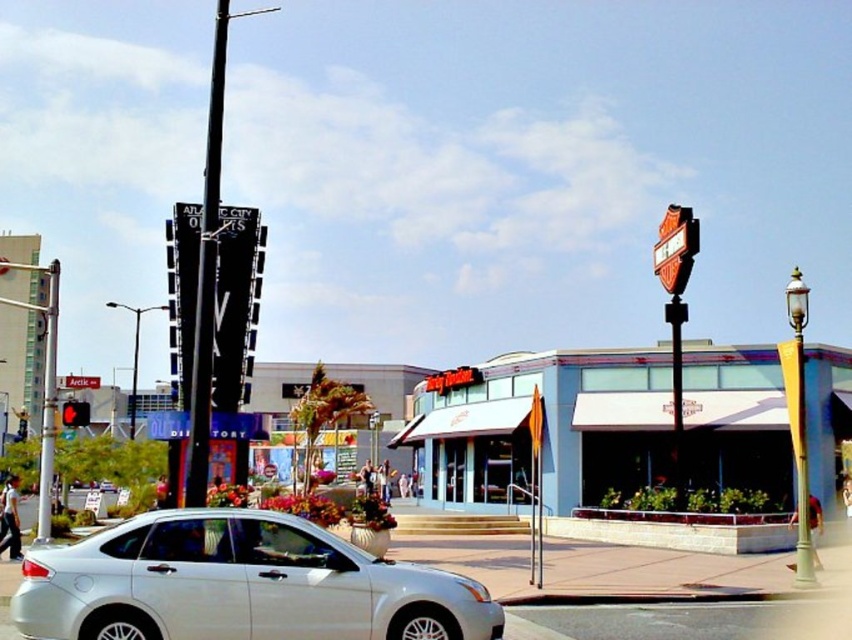
Who is shorter, black metal pole at upper left or red glass traffic light at left?

Standing shorter between the two is red glass traffic light at left.

Which is below, black metal pole at upper left or red glass traffic light at left?

red glass traffic light at left is lower down.

This screenshot has height=640, width=852. What do you see at coordinates (206, 275) in the screenshot? I see `black metal pole at upper left` at bounding box center [206, 275].

Where is `black metal pole at upper left`? The height and width of the screenshot is (640, 852). black metal pole at upper left is located at coordinates (206, 275).

Does white glossy sedan at lower left appear over metallic traffic light at left?

Correct, white glossy sedan at lower left is located above metallic traffic light at left.

Who is more forward, (26,576) or (43,484)?

Point (26,576) is more forward.

Image resolution: width=852 pixels, height=640 pixels. Describe the element at coordinates (239, 584) in the screenshot. I see `white glossy sedan at lower left` at that location.

You are a GUI agent. You are given a task and a screenshot of the screen. Output one action in this format:
    pyautogui.click(x=<x>, y=<y>)
    Task: Click on the white glossy sedan at lower left
    The height and width of the screenshot is (640, 852).
    Given the screenshot: What is the action you would take?
    pyautogui.click(x=239, y=584)

Which of these two, black metal pole at upper left or metallic traffic light at left, stands shorter?

With less height is metallic traffic light at left.

Between point (216, 52) and point (42, 492), which one is positioned behind?

The point (216, 52) is more distant.

Who is more forward, (185,500) or (49,272)?

Positioned in front is point (185,500).

At what (x,y) coordinates should I click in order to perform the action: click on black metal pole at upper left. Please return your answer as a coordinate pair (x, y). Looking at the image, I should click on (206, 275).